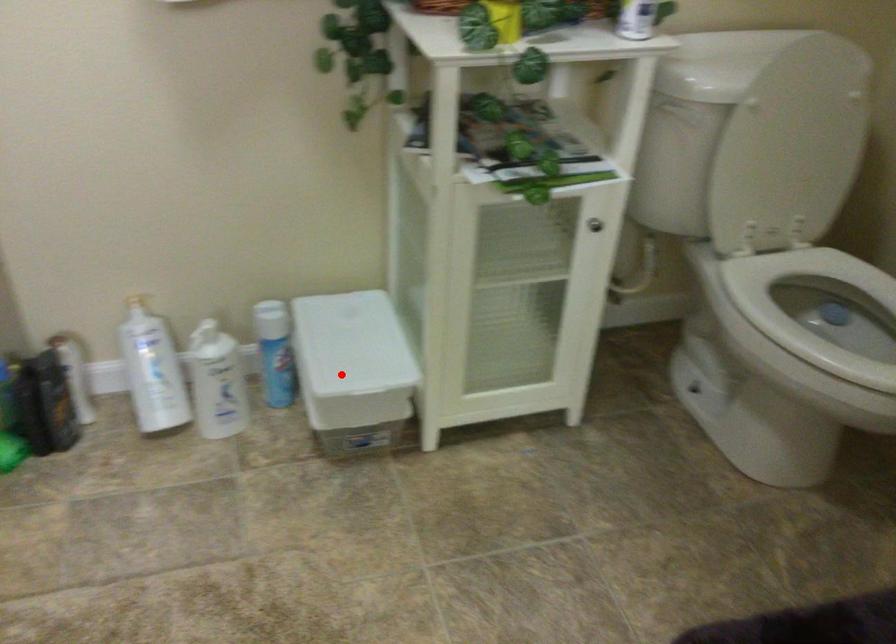
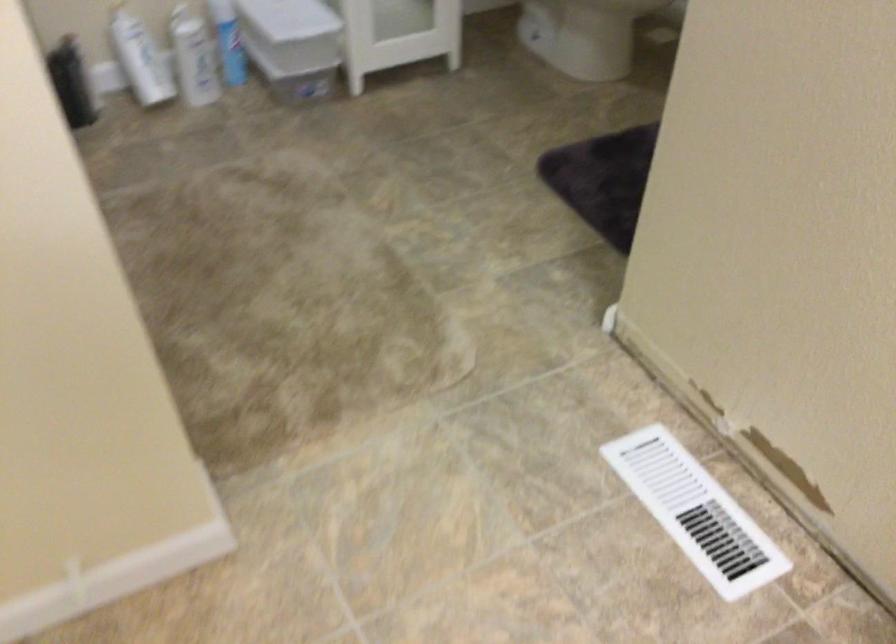
Question: I am providing you with two images of the same scene from different viewpoints. A red point is shown in image1. For the corresponding object point in image2, is it positioned nearer or farther from the camera?

Choices:
 (A) Nearer
 (B) Farther

Answer: (B)